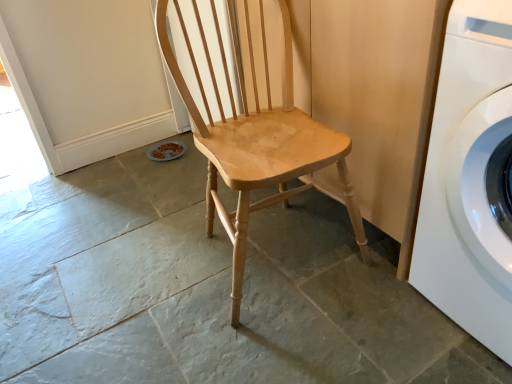
Question: From a real-world perspective, is white glossy washing machine at right above or below natural wood chair at center?

Choices:
 (A) below
 (B) above

Answer: (A)

Question: Would you say white glossy washing machine at right is to the left or to the right of natural wood chair at center in the picture?

Choices:
 (A) right
 (B) left

Answer: (A)

Question: Is white glossy washing machine at right wider or thinner than natural wood chair at center?

Choices:
 (A) wide
 (B) thin

Answer: (A)

Question: Choose the correct answer: Is natural wood chair at center inside white glossy washing machine at right or outside it?

Choices:
 (A) inside
 (B) outside

Answer: (B)

Question: In the image, is natural wood chair at center positioned in front of or behind white glossy washing machine at right?

Choices:
 (A) behind
 (B) front

Answer: (A)

Question: Considering the positions of natural wood chair at center and white glossy washing machine at right in the image, is natural wood chair at center taller or shorter than white glossy washing machine at right?

Choices:
 (A) tall
 (B) short

Answer: (A)

Question: From the image's perspective, is natural wood chair at center positioned above or below white glossy washing machine at right?

Choices:
 (A) above
 (B) below

Answer: (A)